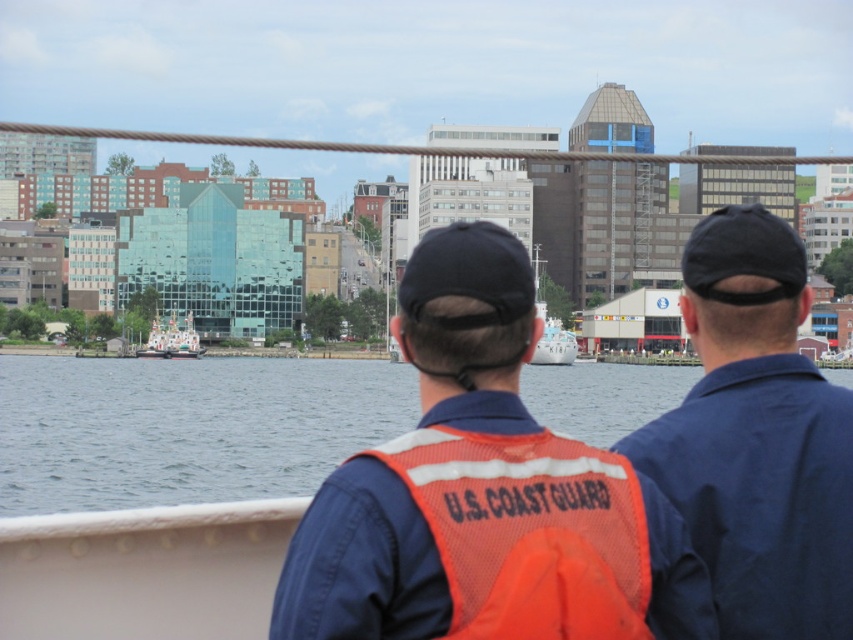
You are a drone operator trying to fly a drone between the blue uniform at center and the orange mesh safety vest at center. The drone has a wingspan of 1.5 meters. Can the drone safely pass through the space between them?

The blue uniform at center is 3.05 meters away from the orange mesh safety vest at center. Since the drone has a wingspan of 1.5 meters, it can safely pass through the space between them as the distance is more than double the wingspan.

You are standing at the position of the observer on the boat and see two points marked in the image. Which point, point (718,214) or point (169,323), is closer to you?

Point (718,214) is closer to you because it is in front of point (169,323).